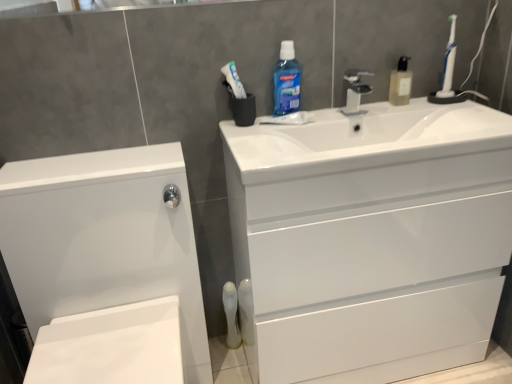
Question: From the image's perspective, is white glossy cabinet at lower left over blue translucent liquid at upper center, the first cleaning product viewed from the left?

Choices:
 (A) no
 (B) yes

Answer: (A)

Question: Is white glossy cabinet at lower left positioned with its back to blue translucent liquid at upper center, acting as the second cleaning product starting from the right?

Choices:
 (A) yes
 (B) no

Answer: (B)

Question: Is white glossy cabinet at lower left directly adjacent to blue translucent liquid at upper center, the first cleaning product viewed from the left?

Choices:
 (A) yes
 (B) no

Answer: (B)

Question: Does white glossy cabinet at lower left lie behind blue translucent liquid at upper center, acting as the second cleaning product starting from the right?

Choices:
 (A) yes
 (B) no

Answer: (B)

Question: Can you confirm if white glossy cabinet at lower left is positioned to the left of blue translucent liquid at upper center, the first cleaning product viewed from the left?

Choices:
 (A) yes
 (B) no

Answer: (A)

Question: Is white glossy cabinet at lower left at the right side of blue translucent liquid at upper center, the first cleaning product viewed from the left?

Choices:
 (A) no
 (B) yes

Answer: (A)

Question: Is translucent plastic soap dispenser at upper right, the 1th cleaning product from the right, wider than satin nickel faucet at center?

Choices:
 (A) yes
 (B) no

Answer: (A)

Question: Is translucent plastic soap dispenser at upper right, the 1th cleaning product from the right, facing towards satin nickel faucet at center?

Choices:
 (A) yes
 (B) no

Answer: (B)

Question: Is translucent plastic soap dispenser at upper right, the 1th cleaning product from the right, positioned with its back to satin nickel faucet at center?

Choices:
 (A) yes
 (B) no

Answer: (B)

Question: From a real-world perspective, is translucent plastic soap dispenser at upper right, the 1th cleaning product from the right, on top of satin nickel faucet at center?

Choices:
 (A) yes
 (B) no

Answer: (A)

Question: Is translucent plastic soap dispenser at upper right, the second cleaning product from the left, next to satin nickel faucet at center and touching it?

Choices:
 (A) no
 (B) yes

Answer: (A)

Question: Is translucent plastic soap dispenser at upper right, the second cleaning product from the left, further to camera compared to satin nickel faucet at center?

Choices:
 (A) yes
 (B) no

Answer: (A)

Question: Is white plastic toothbrush at upper right further to camera compared to white glossy cabinet at lower left?

Choices:
 (A) yes
 (B) no

Answer: (A)